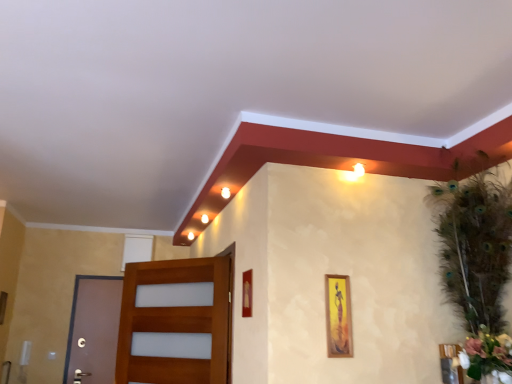
Question: Does wooden picture frame at center-right, the 2th picture frame positioned from the left, turn towards white matte flower at right?

Choices:
 (A) no
 (B) yes

Answer: (A)

Question: Considering the relative positions of wooden picture frame at center-right, the second picture frame viewed from the right, and white matte flower at right in the image provided, is wooden picture frame at center-right, the second picture frame viewed from the right, in front of white matte flower at right?

Choices:
 (A) no
 (B) yes

Answer: (A)

Question: From a real-world perspective, is wooden picture frame at center-right, the 2th picture frame positioned from the left, physically above white matte flower at right?

Choices:
 (A) no
 (B) yes

Answer: (B)

Question: Does wooden picture frame at center-right, the 2th picture frame positioned from the left, appear on the left side of white matte flower at right?

Choices:
 (A) yes
 (B) no

Answer: (A)

Question: Considering the relative sizes of wooden picture frame at center-right, the second picture frame viewed from the right, and white matte flower at right in the image provided, is wooden picture frame at center-right, the second picture frame viewed from the right, shorter than white matte flower at right?

Choices:
 (A) yes
 (B) no

Answer: (B)

Question: Are wooden picture frame at center-right, the second picture frame viewed from the right, and white matte flower at right making contact?

Choices:
 (A) yes
 (B) no

Answer: (B)

Question: From the image's perspective, is white matte flower at right under wooden picture frame at center-right, the 2th picture frame positioned from the left?

Choices:
 (A) yes
 (B) no

Answer: (A)

Question: Is white matte flower at right facing towards wooden picture frame at center-right, the second picture frame viewed from the right?

Choices:
 (A) yes
 (B) no

Answer: (B)

Question: Considering the relative sizes of white matte flower at right and wooden picture frame at center-right, the second picture frame viewed from the right, in the image provided, is white matte flower at right wider than wooden picture frame at center-right, the second picture frame viewed from the right,?

Choices:
 (A) no
 (B) yes

Answer: (B)

Question: Is white matte flower at right located outside wooden picture frame at center-right, the second picture frame viewed from the right?

Choices:
 (A) no
 (B) yes

Answer: (B)

Question: Can you confirm if white matte flower at right is positioned to the right of wooden picture frame at center-right, the second picture frame viewed from the right?

Choices:
 (A) yes
 (B) no

Answer: (A)

Question: Would you say white matte flower at right contains wooden picture frame at center-right, the second picture frame viewed from the right?

Choices:
 (A) yes
 (B) no

Answer: (B)

Question: Is matte gold picture frame at center, which appears as the 1th picture frame when viewed from the left, looking in the opposite direction of brown matte door at left, which is the second door from right to left?

Choices:
 (A) yes
 (B) no

Answer: (B)